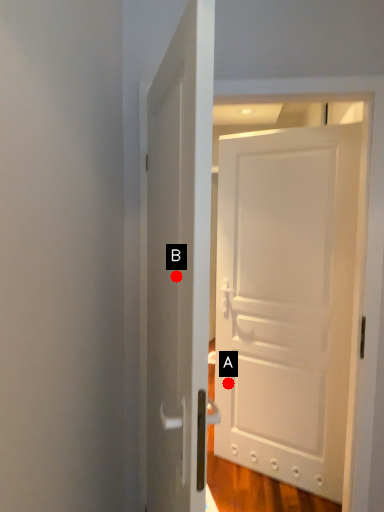
Question: Two points are circled on the image, labeled by A and B beside each circle. Which of the following is the farthest from the observer?

Choices:
 (A) A is further
 (B) B is further

Answer: (A)